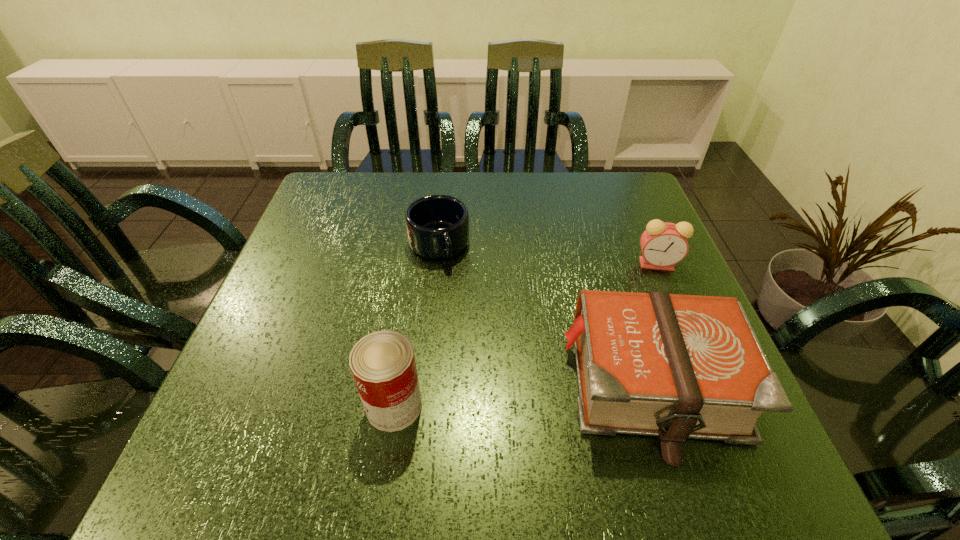
At what (x,y) coordinates should I click in order to perform the action: click on free spot located 0.110m on the face of the alarm clock. Please return your answer as a coordinate pair (x, y). Image resolution: width=960 pixels, height=540 pixels. Looking at the image, I should click on (613, 292).

At what (x,y) coordinates should I click in order to perform the action: click on blank area located 0.340m with the handle on the side of the mug. Please return your answer as a coordinate pair (x, y). Looking at the image, I should click on (499, 391).

Image resolution: width=960 pixels, height=540 pixels. Find the location of `free space located with the handle on the side of the mug`. free space located with the handle on the side of the mug is located at coordinates pos(481,348).

You are a GUI agent. You are given a task and a screenshot of the screen. Output one action in this format:
    pyautogui.click(x=<x>, y=<y>)
    Task: Click on the free space located with the handle on the side of the mug
    
    Given the screenshot: What is the action you would take?
    pyautogui.click(x=471, y=325)

Image resolution: width=960 pixels, height=540 pixels. In order to click on can situated at the near edge in this screenshot , I will do `click(382, 363)`.

What are the coordinates of `Bible that is at the near edge` in the screenshot? It's located at (674, 366).

Find the location of a particular element. This screenshot has height=540, width=960. Bible that is at the right edge is located at coordinates (674, 366).

Where is `alarm clock located in the right edge section of the desktop`? The height and width of the screenshot is (540, 960). alarm clock located in the right edge section of the desktop is located at coordinates (663, 244).

Locate an element on the screen. This screenshot has height=540, width=960. object located at the near right corner is located at coordinates click(674, 366).

In the image, there is a desktop. At what (x,y) coordinates should I click in order to perform the action: click on vacant space at the far edge. Please return your answer as a coordinate pair (x, y). Looking at the image, I should click on (553, 197).